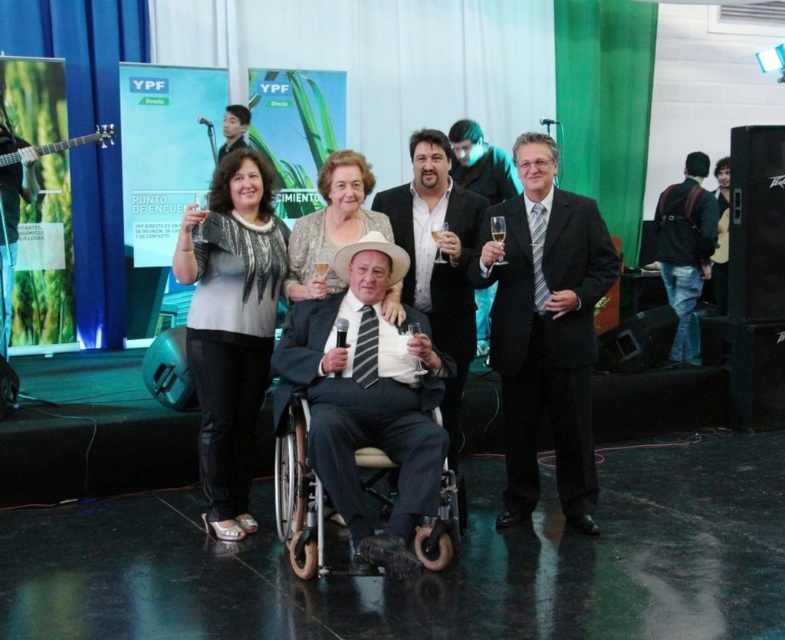
Question: Is black satin suit at right closer to camera compared to matte black suit at upper center?

Choices:
 (A) yes
 (B) no

Answer: (A)

Question: Can you confirm if striped tie at center is bigger than metallic silver wheelchair at center?

Choices:
 (A) yes
 (B) no

Answer: (B)

Question: Considering the real-world distances, which object is farthest from the matte black suit at upper center?

Choices:
 (A) matte white hat at center
 (B) striped tie at center
 (C) matte gray sweater at center

Answer: (B)

Question: Which object appears farthest from the camera in this image?

Choices:
 (A) black leather jacket at right
 (B) matte gray sweater at center
 (C) metallic silver wheelchair at center

Answer: (A)

Question: Is metallic silver wheelchair at center closer to camera compared to matte white hat at center?

Choices:
 (A) no
 (B) yes

Answer: (B)

Question: Based on their relative distances, which object is farther from the metallic silver wheelchair at center?

Choices:
 (A) matte white hat at center
 (B) clear glass champagne flute at center
 (C) black satin suit at right
 (D) striped tie at center

Answer: (B)